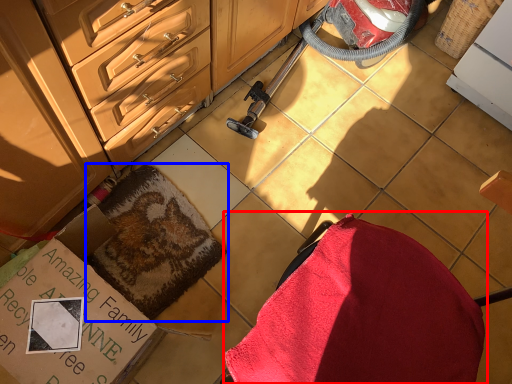
Question: Among these objects, which one is nearest to the camera, swivel chair (highlighted by a red box) or blanket (highlighted by a blue box)?

Choices:
 (A) swivel chair
 (B) blanket

Answer: (A)